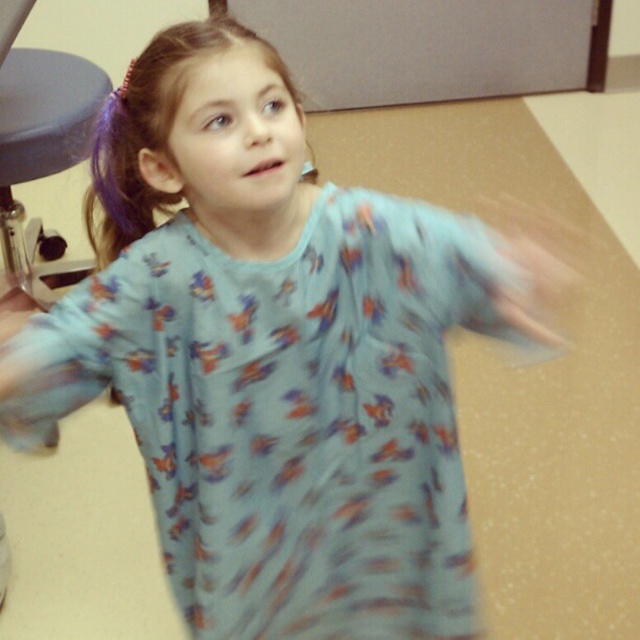
Is purple silky hair at upper left to the left of matte skin hand at lower left from the viewer's perspective?

Incorrect, purple silky hair at upper left is not on the left side of matte skin hand at lower left.

Is point (156, 93) positioned before point (1, 292)?

Yes.

Who is more distant from viewer, (148, 132) or (28, 294)?

Positioned behind is point (28, 294).

Find the location of a particular element. The height and width of the screenshot is (640, 640). purple silky hair at upper left is located at coordinates (148, 129).

Looking at this image, who is shorter, matte gray swivel chair at left or matte skin hand at lower left?

With less height is matte skin hand at lower left.

Does matte gray swivel chair at left have a greater height compared to matte skin hand at lower left?

Indeed, matte gray swivel chair at left has a greater height compared to matte skin hand at lower left.

What do you see at coordinates (40, 134) in the screenshot?
I see `matte gray swivel chair at left` at bounding box center [40, 134].

Where is `matte gray swivel chair at left`? matte gray swivel chair at left is located at coordinates (40, 134).

Is purple silky hair at upper left further to camera compared to matte gray swivel chair at left?

That is False.

Is purple silky hair at upper left closer to camera compared to matte gray swivel chair at left?

Yes, purple silky hair at upper left is closer to the viewer.

Who is more forward, (113, 125) or (35, 58)?

Point (113, 125) is in front.

At what (x,y) coordinates should I click in order to perform the action: click on purple silky hair at upper left. Please return your answer as a coordinate pair (x, y). Looking at the image, I should click on (148, 129).